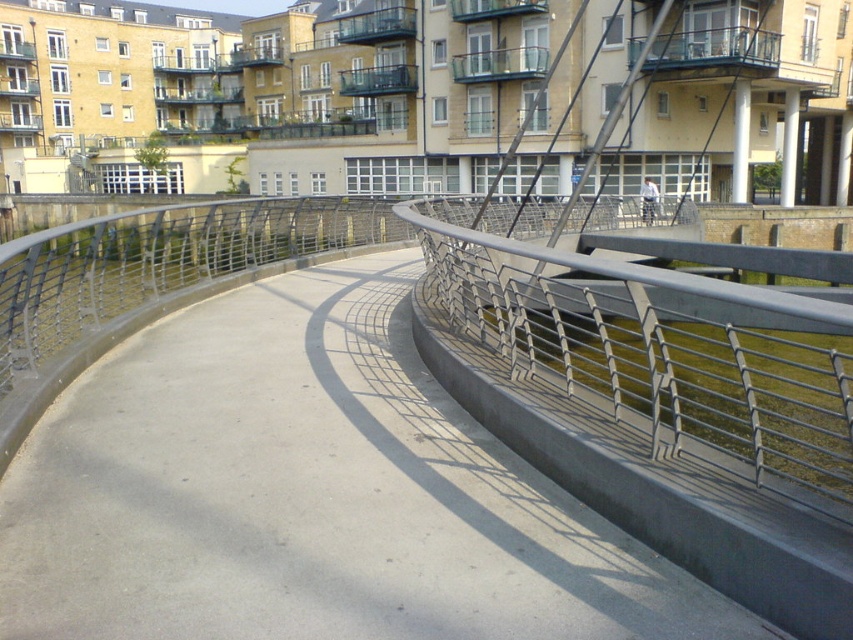
Which of these two, smooth concrete path at center or metallic gray railing at center, stands taller?

With more height is metallic gray railing at center.

Can you confirm if smooth concrete path at center is bigger than metallic gray railing at center?

Incorrect, smooth concrete path at center is not larger than metallic gray railing at center.

At what (x,y) coordinates should I click in order to perform the action: click on smooth concrete path at center. Please return your answer as a coordinate pair (x, y). This screenshot has height=640, width=853. Looking at the image, I should click on (309, 493).